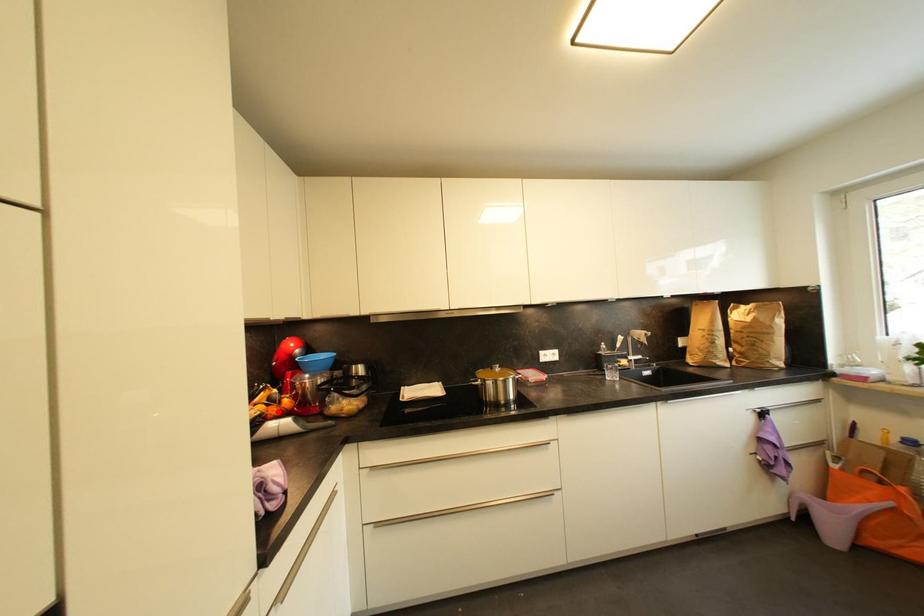
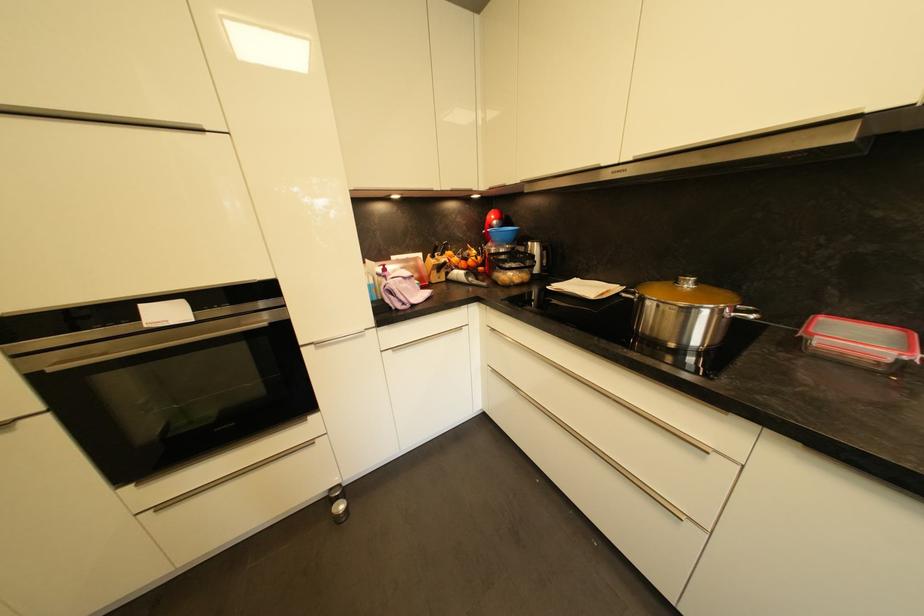
Where in the second image is the point corresponding to the highlighted location from the first image?

(468, 265)